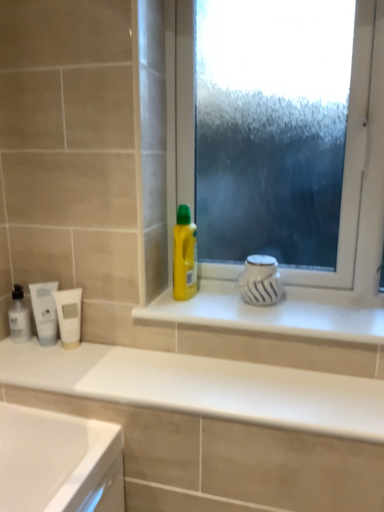
Question: Can you confirm if frosted glass window at center is bigger than translucent plastic mouthwash at left, which is counted as the first mouthwash, starting from the left?

Choices:
 (A) yes
 (B) no

Answer: (A)

Question: Is frosted glass window at center to the right of translucent plastic mouthwash at left, which is the third mouthwash in right-to-left order, from the viewer's perspective?

Choices:
 (A) no
 (B) yes

Answer: (B)

Question: Is frosted glass window at center further to the viewer compared to translucent plastic mouthwash at left, which is counted as the first mouthwash, starting from the left?

Choices:
 (A) no
 (B) yes

Answer: (A)

Question: Is frosted glass window at center beside translucent plastic mouthwash at left, which is counted as the first mouthwash, starting from the left?

Choices:
 (A) yes
 (B) no

Answer: (B)

Question: Is frosted glass window at center smaller than translucent plastic mouthwash at left, which is counted as the first mouthwash, starting from the left?

Choices:
 (A) yes
 (B) no

Answer: (B)

Question: Is translucent plastic mouthwash at left, which is the third mouthwash in right-to-left order, inside or outside of yellow plastic bottle at center?

Choices:
 (A) inside
 (B) outside

Answer: (B)

Question: In the image, is translucent plastic mouthwash at left, which is counted as the first mouthwash, starting from the left, on the left side or the right side of yellow plastic bottle at center?

Choices:
 (A) right
 (B) left

Answer: (B)

Question: In terms of width, does translucent plastic mouthwash at left, which is counted as the first mouthwash, starting from the left, look wider or thinner when compared to yellow plastic bottle at center?

Choices:
 (A) wide
 (B) thin

Answer: (B)

Question: From a real-world perspective, relative to yellow plastic bottle at center, is translucent plastic mouthwash at left, which is counted as the first mouthwash, starting from the left, vertically above or below?

Choices:
 (A) above
 (B) below

Answer: (B)

Question: Is frosted glass window at center wider or thinner than white matte tube at left, which is the 2th mouthwash from right to left?

Choices:
 (A) wide
 (B) thin

Answer: (A)

Question: From the image's perspective, is frosted glass window at center located above or below white matte tube at left, which is the 2th mouthwash from right to left?

Choices:
 (A) below
 (B) above

Answer: (B)

Question: Is point (352, 152) closer or farther from the camera than point (34, 291)?

Choices:
 (A) closer
 (B) farther

Answer: (A)

Question: Relative to white matte tube at left, the second mouthwash viewed from the left, is frosted glass window at center in front or behind?

Choices:
 (A) behind
 (B) front

Answer: (B)

Question: From a real-world perspective, relative to white matte tube at lower left, which is the third mouthwash in left-to-right order, is translucent plastic mouthwash at left, which is the third mouthwash in right-to-left order, vertically above or below?

Choices:
 (A) above
 (B) below

Answer: (B)

Question: From the image's perspective, relative to white matte tube at lower left, which is the third mouthwash in left-to-right order, is translucent plastic mouthwash at left, which is the third mouthwash in right-to-left order, above or below?

Choices:
 (A) above
 (B) below

Answer: (A)